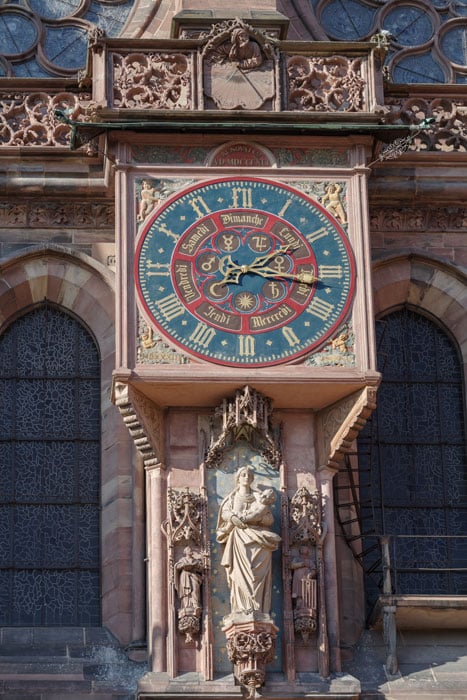
What are the coordinates of `red rim of clock face` in the screenshot? It's located at (194, 354).